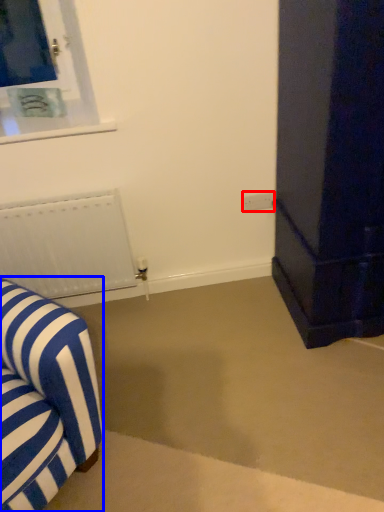
Question: Which point is closer to the camera, electric outlet (highlighted by a red box) or furniture (highlighted by a blue box)?

Choices:
 (A) electric outlet
 (B) furniture

Answer: (B)